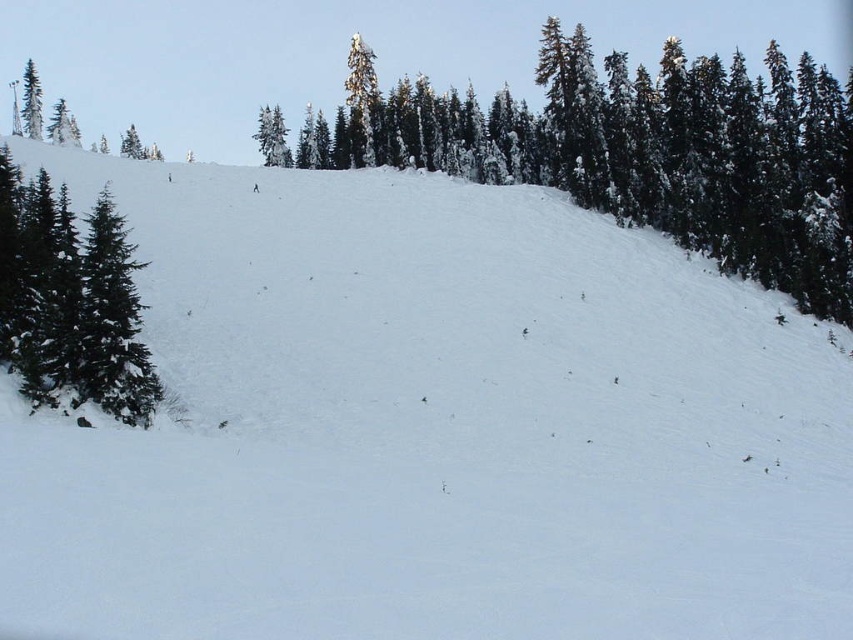
Between point (45, 256) and point (30, 124), which one is positioned behind?

Point (30, 124)

The height and width of the screenshot is (640, 853). In order to click on green matte tree at left in this screenshot , I will do `click(70, 301)`.

Is green textured trees at upper center shorter than green matte tree at upper left?

In fact, green textured trees at upper center may be taller than green matte tree at upper left.

In the scene shown: Is green textured trees at upper center smaller than green matte tree at upper left?

Actually, green textured trees at upper center might be larger than green matte tree at upper left.

Between point (705, 129) and point (22, 104), which one is positioned in front?

Point (705, 129) is more forward.

In order to click on green textured trees at upper center in this screenshot , I will do `click(633, 150)`.

Does green textured trees at upper center have a greater width compared to green matte tree at left?

Correct, the width of green textured trees at upper center exceeds that of green matte tree at left.

Is green textured trees at upper center positioned in front of green matte tree at left?

No, it is behind green matte tree at left.

Does point (415, 96) come closer to viewer compared to point (102, 317)?

No, it is behind (102, 317).

Locate an element on the screen. The height and width of the screenshot is (640, 853). green textured trees at upper center is located at coordinates (633, 150).